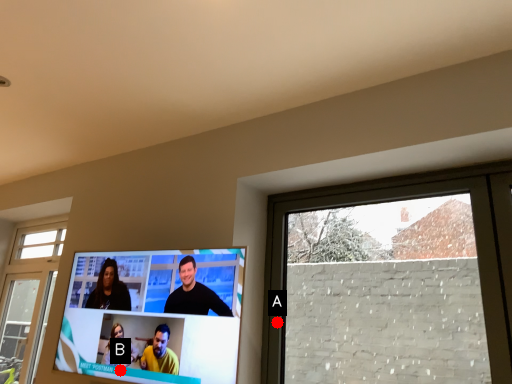
Question: Two points are circled on the image, labeled by A and B beside each circle. Which point appears closest to the camera in this image?

Choices:
 (A) A is closer
 (B) B is closer

Answer: (B)